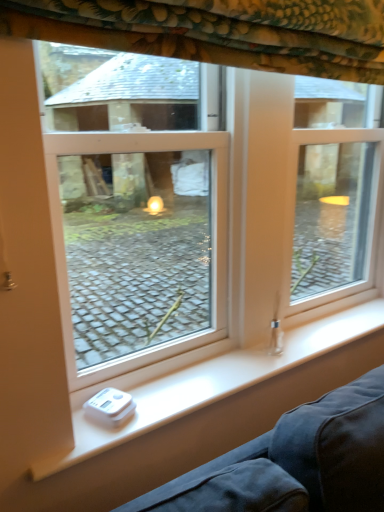
Describe the element at coordinates (139, 216) in the screenshot. I see `white plastic window at center` at that location.

This screenshot has width=384, height=512. I want to click on white plastic scale at lower left, so 215,383.

Does white plastic window at center have a greater height compared to white plastic scale at lower left?

Indeed, white plastic window at center has a greater height compared to white plastic scale at lower left.

From the image's perspective, is white plastic window at center on top of white plastic scale at lower left?

Yes, from the image's perspective, white plastic window at center is on top of white plastic scale at lower left.

Does point (101, 196) lie behind point (74, 457)?

Yes.

Which object is closer to the camera, white plastic window at center or white plastic scale at lower left?

white plastic window at center.

In the scene shown: Is there a large distance between white plastic scale at lower left and floral fabric curtain at upper center?

Actually, white plastic scale at lower left and floral fabric curtain at upper center are a little close together.

Is point (173, 404) positioned before point (122, 16)?

No, (173, 404) is further to viewer.

Is floral fabric curtain at upper center at the back of white plastic scale at lower left?

white plastic scale at lower left does not have its back to floral fabric curtain at upper center.

From their relative heights in the image, would you say white plastic scale at lower left is taller or shorter than floral fabric curtain at upper center?

white plastic scale at lower left is shorter than floral fabric curtain at upper center.

From a real-world perspective, between floral fabric curtain at upper center and white plastic window at center, who is vertically higher?

floral fabric curtain at upper center.

From the image's perspective, between floral fabric curtain at upper center and white plastic window at center, which one is located above?

floral fabric curtain at upper center.

From the picture: What's the angular difference between floral fabric curtain at upper center and white plastic window at center's facing directions?

There is a 2.78-degree angle between the facing directions of floral fabric curtain at upper center and white plastic window at center.

Is floral fabric curtain at upper center positioned with its back to white plastic scale at lower left?

No, white plastic scale at lower left is not at the back of floral fabric curtain at upper center.

Based on the photo, based on their sizes in the image, would you say floral fabric curtain at upper center is bigger or smaller than white plastic scale at lower left?

Clearly, floral fabric curtain at upper center is larger in size than white plastic scale at lower left.

Does point (100, 39) come in front of point (136, 394)?

Yes.

Between floral fabric curtain at upper center and white plastic scale at lower left, which one has smaller width?

With smaller width is white plastic scale at lower left.

Does white plastic window at center have a lesser height compared to floral fabric curtain at upper center?

In fact, white plastic window at center may be taller than floral fabric curtain at upper center.

Locate an element on the screen. This screenshot has width=384, height=512. window below the floral fabric curtain at upper center (from a real-world perspective) is located at coordinates (139, 216).

Does white plastic window at center appear on the right side of floral fabric curtain at upper center?

Correct, you'll find white plastic window at center to the right of floral fabric curtain at upper center.

Can we say white plastic window at center lies outside floral fabric curtain at upper center?

That's correct, white plastic window at center is outside of floral fabric curtain at upper center.

Is white plastic scale at lower left wider or thinner than white plastic window at center?

Clearly, white plastic scale at lower left has more width compared to white plastic window at center.

Is white plastic scale at lower left not near white plastic window at center?

white plastic scale at lower left is far away from white plastic window at center.

Which object is closer to the camera, white plastic scale at lower left or white plastic window at center?

white plastic window at center.

Between point (137, 417) and point (82, 104), which one is positioned in front?

The point (137, 417) is closer to the camera.

The image size is (384, 512). In order to click on window above the white plastic scale at lower left (from the image's perspective) in this screenshot , I will do `click(139, 216)`.

I want to click on curtain in front of the white plastic scale at lower left, so click(x=219, y=31).

From the image, which object appears to be nearer to white plastic window at center, white plastic scale at lower left or floral fabric curtain at upper center?

white plastic scale at lower left.

From the image, which object appears to be nearer to floral fabric curtain at upper center, white plastic window at center or white plastic scale at lower left?

white plastic scale at lower left is positioned closer to the anchor floral fabric curtain at upper center.

Estimate the real-world distances between objects in this image. Which object is further from white plastic window at center, floral fabric curtain at upper center or white plastic scale at lower left?

Result: The object further to white plastic window at center is floral fabric curtain at upper center.

Which object lies further to the anchor point white plastic scale at lower left, white plastic window at center or floral fabric curtain at upper center?

white plastic window at center is positioned further to the anchor white plastic scale at lower left.

When comparing their distances from white plastic scale at lower left, does floral fabric curtain at upper center or white plastic window at center seem further?

white plastic window at center is further to white plastic scale at lower left.

Based on their spatial positions, is white plastic scale at lower left or white plastic window at center closer to floral fabric curtain at upper center?

white plastic scale at lower left lies closer to floral fabric curtain at upper center than the other object.

Locate an element on the screen. The image size is (384, 512). window between floral fabric curtain at upper center and white plastic scale at lower left vertically is located at coordinates (139, 216).